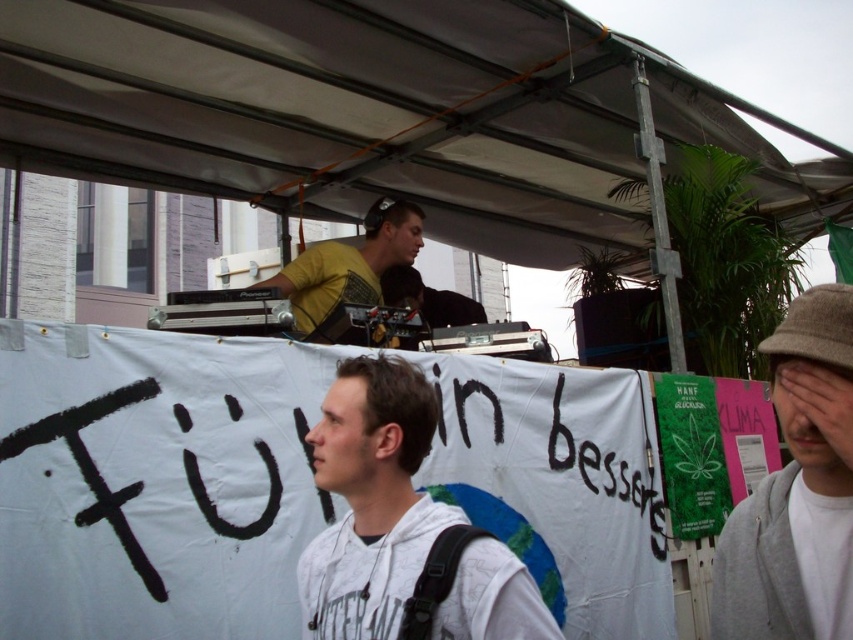
You are standing at the entrance of the canopy tent and see the gray woolen hat at lower right and the yellow matte shirt at upper center. Which object is closer to you?

The gray woolen hat at lower right is closer to you because it is in front of the yellow matte shirt at upper center.

You are attending an outdoor event under a large canopy tent. You notice two items in the scene described as a white hoodie at center and a yellow matte shirt at upper center. Based on their positions, which item is closer to the ground?

The white hoodie at center is closer to the ground since it is positioned below the yellow matte shirt at upper center.

You are a photographer standing in front of the banner with the text and blue design. You notice a white hoodie at center and a yellow matte shirt at upper center. Which clothing item is positioned closer to you?

The white hoodie at center is closer to the viewer than the yellow matte shirt at upper center.